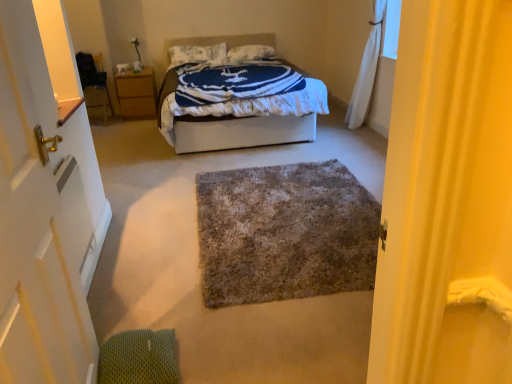
The width and height of the screenshot is (512, 384). What are the coordinates of `free point behind shaggy gray rug at center` in the screenshot? It's located at (259, 155).